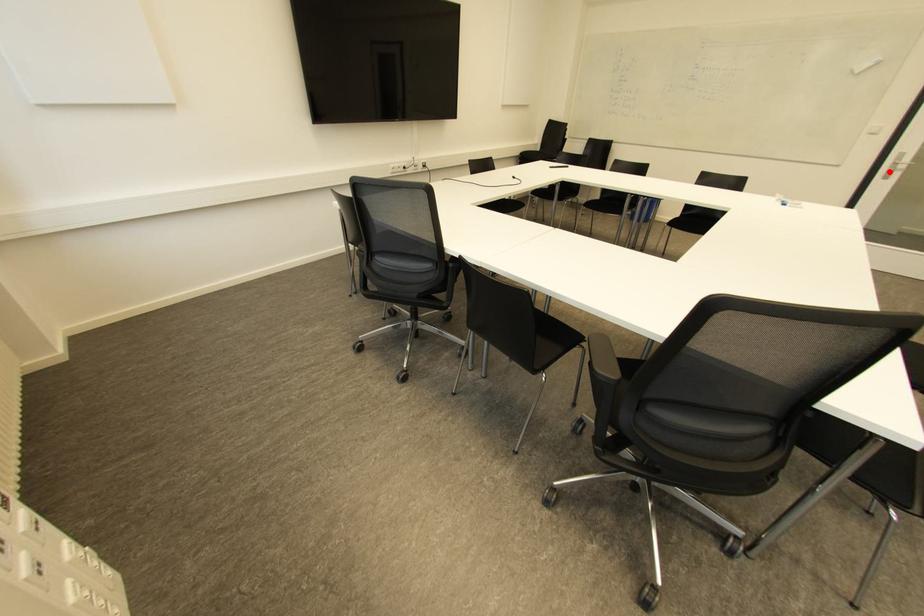
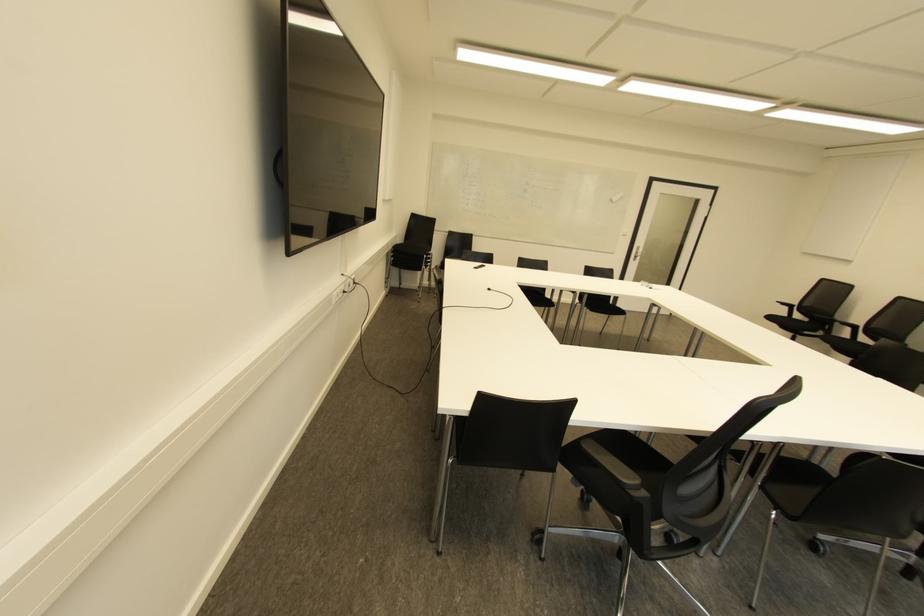
Where in the second image is the point corresponding to the highlighted location from the first image?

(636, 257)